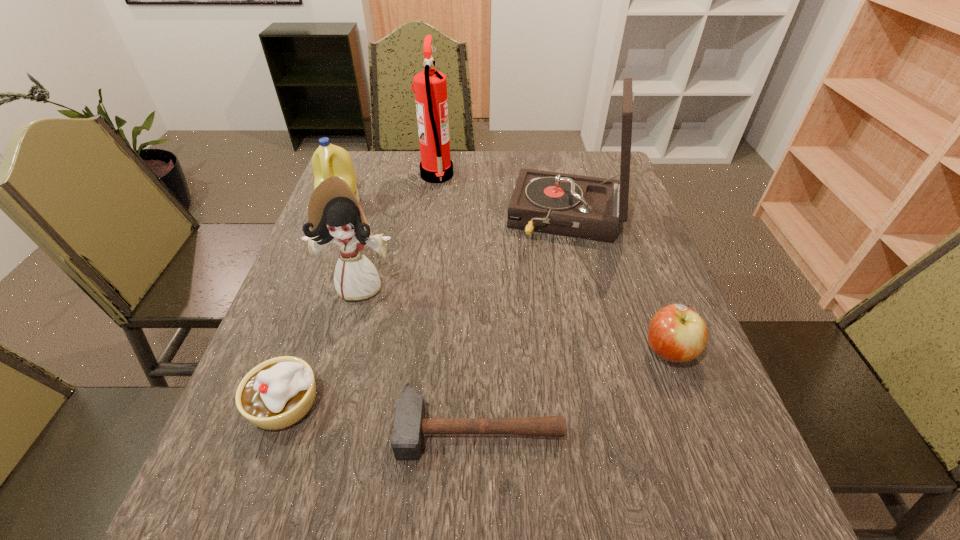
Where is `fire extinguisher`? This screenshot has height=540, width=960. fire extinguisher is located at coordinates (430, 86).

Image resolution: width=960 pixels, height=540 pixels. What are the coordinates of `phonograph record` in the screenshot? It's located at (585, 207).

Where is `the fourth nearest object`? the fourth nearest object is located at coordinates (334, 214).

Where is `the fifth shortest object`? the fifth shortest object is located at coordinates (334, 214).

The width and height of the screenshot is (960, 540). Identify the location of the fourth tallest object. (328, 160).

Find the location of a particular element. This screenshot has height=540, width=960. apple is located at coordinates (676, 333).

Locate an element on the screen. whipped cream is located at coordinates (277, 393).

At what (x,y) coordinates should I click in order to perform the action: click on hammer. Please return your answer as a coordinate pair (x, y). This screenshot has height=540, width=960. Looking at the image, I should click on (409, 425).

What are the coordinates of `blank area located with the nozzle aimed from the fire extinguisher` in the screenshot? It's located at (555, 176).

You are a GUI agent. You are given a task and a screenshot of the screen. Output one action in this format:
    pyautogui.click(x=<x>, y=<y>)
    Task: Click on the free space located 0.070m on the left of the phonograph record
    This screenshot has height=540, width=960.
    Given the screenshot: What is the action you would take?
    pyautogui.click(x=481, y=218)